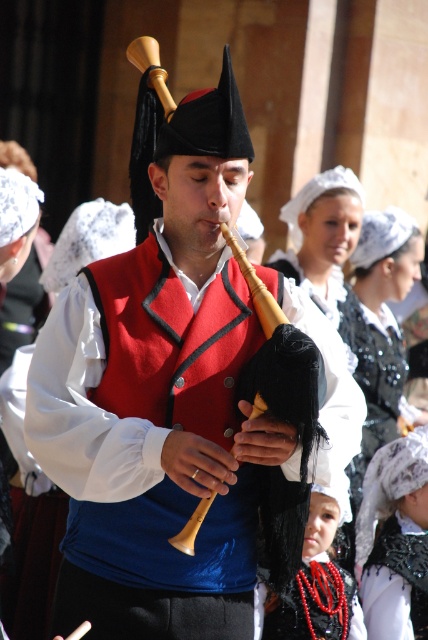
You are a photographer at a cultural event. You need to capture a photo of the matte red vest at center and the black sequined dress at center. Based on their positions, which object should you focus on first to ensure both are in frame?

The matte red vest at center is much taller than the black sequined dress at center, so you should focus on the matte red vest at center first to ensure both are in frame.

You are a photographer trying to capture the man playing the bagpipe. You notice the matte red vest at center and the wooden bagpipe at center. Which object should you focus on first if you want to capture the subject of the performance?

The matte red vest at center is to the left of the wooden bagpipe at center, so focusing on the wooden bagpipe at center first would center the subject of the performance as it is positioned more towards the center of the image.

You are a photographer at a cultural event and want to capture a clear shot of the wooden bagpipe at center. However, there is a black sequined dress at center in the way. Can you adjust your position to see the bagpipe without the dress blocking it?

The wooden bagpipe at center is behind the black sequined dress at center, so you cannot see the bagpipe without moving the dress or changing your angle.